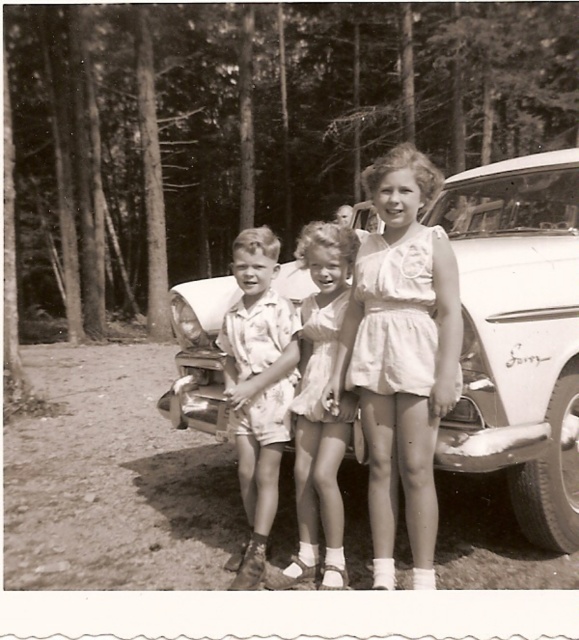
You are a photographer trying to decide where to place a new prop between the two dresses. Which dress, the white cotton dress at center or the matte white dress at center, has a wider silhouette to accommodate the prop?

The white cotton dress at center might be wider than matte white dress at center, so it can accommodate the prop better.

You are a photographer trying to capture a clear shot of the white glossy car at center and the floral fabric shorts at center. Based on their positions, which object is closer to the camera?

The white glossy car at center is closer to the camera than the floral fabric shorts at center because it is positioned in front of it.